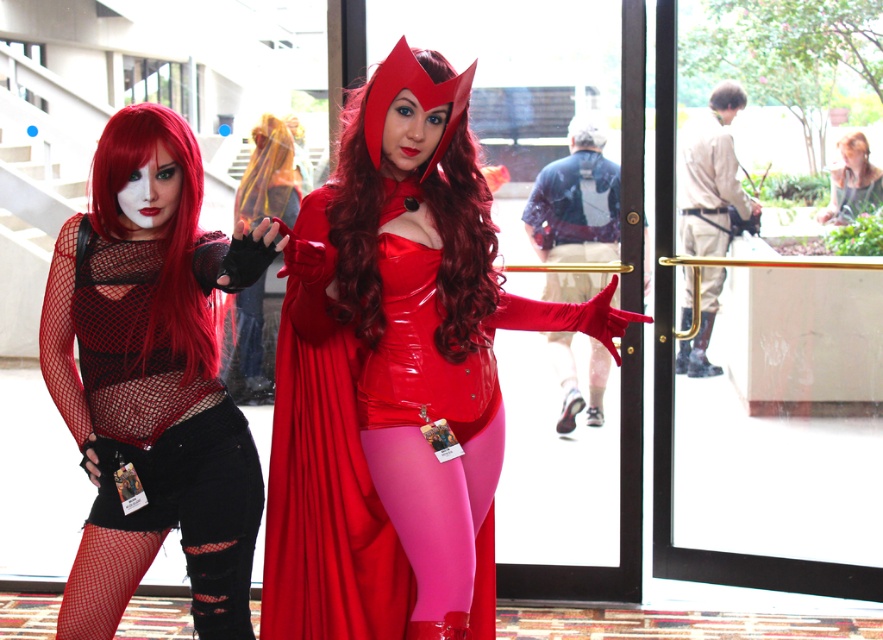
You are a photographer setting up for a photoshoot. You need to position a spotlight so that it illuminates the shiny red costume at center without affecting the matte black wig at upper center. Based on their positions, can you place the spotlight in a way that achieves this?

The shiny red costume at center is in front of the matte black wig at upper center. Therefore, placing the spotlight directly in front of the shiny red costume at center will illuminate it while the matte black wig at upper center, being behind it, will remain in shadow.

You are standing in front of the two costumed individuals and want to determine which point is nearer to you. The points are labeled as point 1 at coordinates point (x=478, y=294) and point 2 at coordinates point (x=869, y=168). Which point is closer to you?

Point 1 at coordinates point (x=478, y=294) is closer to the viewer than point 2 at coordinates point (x=869, y=168).

You are a photographer at a costume event. You want to take a photo of the fishnet fabric top at left and the shiny red wig at center so that both are in focus. The camera you are using has a depth of field that can cover 20 inches. Will both objects be in focus?

The fishnet fabric top at left and shiny red wig at center are 20.24 inches apart. Since the camera can only cover 20 inches, the distance between them exceeds the depth of field capacity. Therefore, both objects might not be in focus simultaneously.